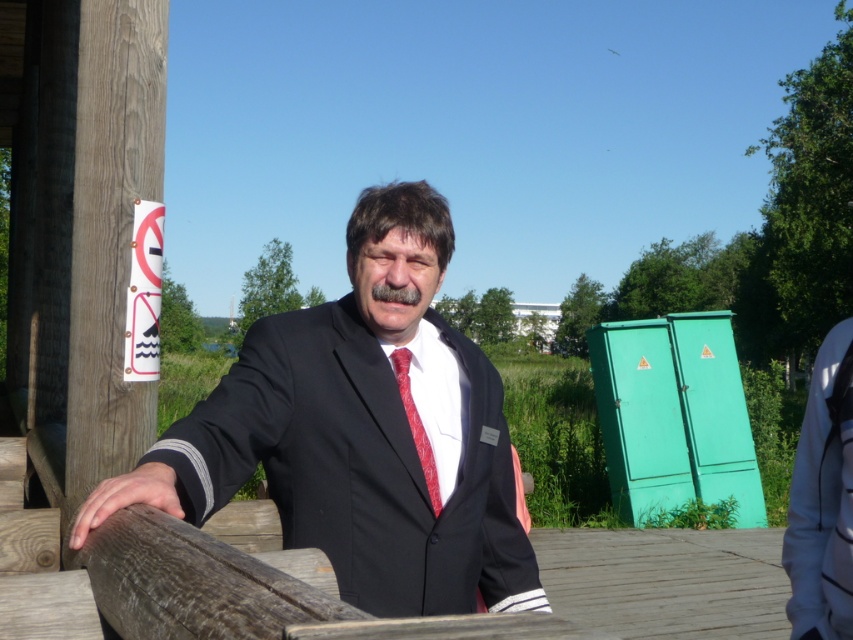
Question: Does white fabric at right have a larger size compared to red satin tie at center?

Choices:
 (A) no
 (B) yes

Answer: (B)

Question: Which is farther from the white fabric at right?

Choices:
 (A) matte black suit at center
 (B) red satin tie at center

Answer: (A)

Question: Among these objects, which one is farthest from the camera?

Choices:
 (A) matte black suit at center
 (B) white fabric at right

Answer: (B)

Question: Which point appears closest to the camera in this image?

Choices:
 (A) tap(438, 506)
 (B) tap(833, 406)
 (C) tap(346, 296)

Answer: (B)

Question: Does matte black suit at center appear on the left side of white fabric at right?

Choices:
 (A) no
 (B) yes

Answer: (B)

Question: Is white fabric at right wider than red satin tie at center?

Choices:
 (A) yes
 (B) no

Answer: (A)